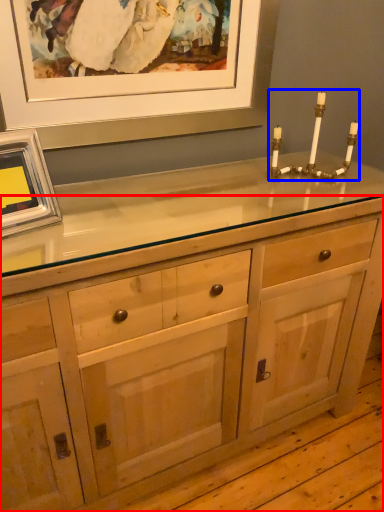
Question: Among these objects, which one is farthest to the camera, chest of drawers (highlighted by a red box) or candle holder (highlighted by a blue box)?

Choices:
 (A) chest of drawers
 (B) candle holder

Answer: (B)